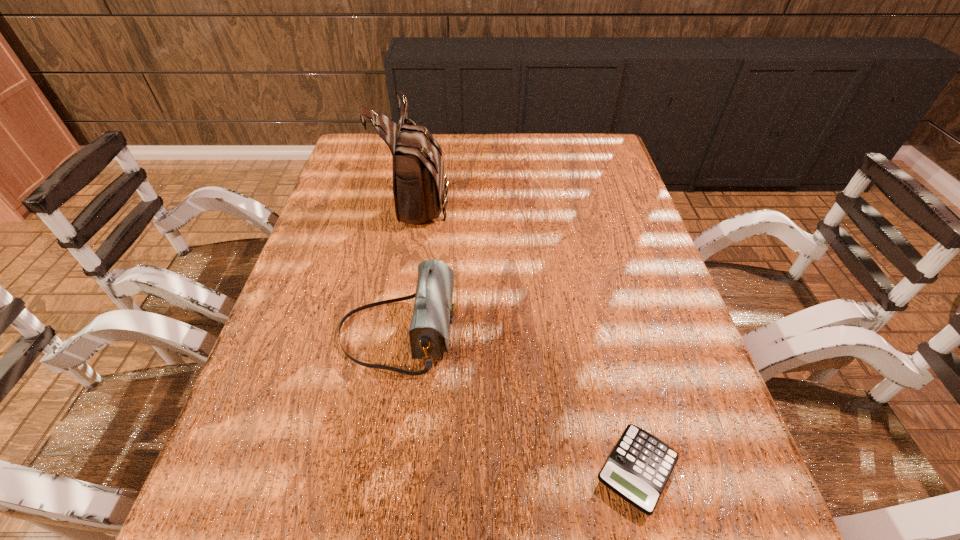
The image size is (960, 540). In order to click on object present at the left edge in this screenshot , I will do 433,312.

In order to click on object positioned at the right edge in this screenshot , I will do `click(638, 468)`.

This screenshot has width=960, height=540. Find the location of `object that is at the near right corner`. object that is at the near right corner is located at coordinates (638, 468).

Identify the location of vacant space at the far edge of the desktop. The height and width of the screenshot is (540, 960). (491, 148).

Identify the location of vacant space at the near edge of the desktop. This screenshot has height=540, width=960. coord(524,534).

Where is `vacant area at the left edge`? The width and height of the screenshot is (960, 540). vacant area at the left edge is located at coordinates (343, 211).

What are the coordinates of `vacant space at the right edge of the desktop` in the screenshot? It's located at (644, 275).

Identify the location of vacant region at the far left corner of the desktop. The image size is (960, 540). (373, 146).

The image size is (960, 540). Identify the location of free space between the farther shoulder bag and the nearer shoulder bag. (408, 266).

Find the location of a particular element. The image size is (960, 540). unoccupied area between the tallest object and the second shortest object is located at coordinates (408, 266).